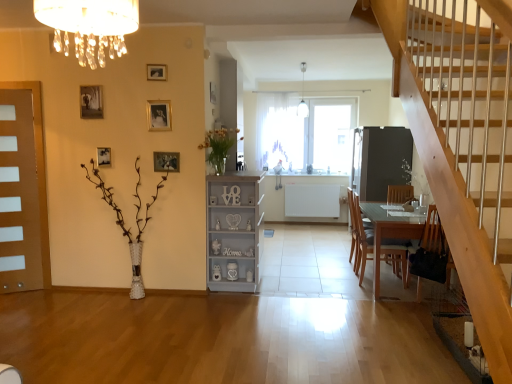
Question: In the image, is matte white crystal chandelier at upper center on the left side or the right side of white textured vase at left, arranged as the first plant when ordered from the bottom?

Choices:
 (A) left
 (B) right

Answer: (B)

Question: Is matte white crystal chandelier at upper center situated inside white textured vase at left, which ranks as the first plant in left-to-right order, or outside?

Choices:
 (A) inside
 (B) outside

Answer: (B)

Question: Which is farther from the matte brown door at left?

Choices:
 (A) translucent glass vase at upper center, placed as the first plant when sorted from right to left
 (B) wooden chair at lower right, acting as the first chair starting from the back
 (C) wooden picture frame at center, marked as the fifth picture frame in a left-to-right arrangement
 (D) white glass pendant light at upper center
 (E) matte white crystal chandelier at upper center

Answer: (D)

Question: Which object is positioned farthest from the matte white crystal chandelier at upper center?

Choices:
 (A) clear glass table at lower right
 (B) wooden picture frame at upper left, the sixth picture frame viewed from the right
 (C) white textured vase at left, which ranks as the first plant in left-to-right order
 (D) matte brown door at left
 (E) white painted wood cabinet at center

Answer: (A)